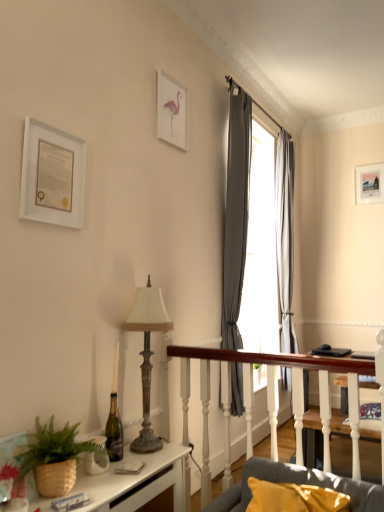
Question: Is white matte picture frame at upper left, the 1th picture frame positioned from the front, surrounding brown woven basket at lower left?

Choices:
 (A) yes
 (B) no

Answer: (B)

Question: From a real-world perspective, is white matte picture frame at upper left, which is counted as the 3th picture frame, starting from the right, on top of brown woven basket at lower left?

Choices:
 (A) no
 (B) yes

Answer: (B)

Question: Does white matte picture frame at upper left, the 1th picture frame positioned from the front, have a smaller size compared to brown woven basket at lower left?

Choices:
 (A) no
 (B) yes

Answer: (B)

Question: Can we say white matte picture frame at upper left, which is the third picture frame from back to front, lies outside brown woven basket at lower left?

Choices:
 (A) no
 (B) yes

Answer: (B)

Question: Is white matte picture frame at upper left, arranged as the first picture frame when viewed from the left, beside brown woven basket at lower left?

Choices:
 (A) no
 (B) yes

Answer: (A)

Question: From the image's perspective, is white matte picture frame at upper left, the 1th picture frame positioned from the front, over brown woven basket at lower left?

Choices:
 (A) no
 (B) yes

Answer: (B)

Question: Does white glossy desk at lower left have a smaller size compared to white matte picture frame at upper center, acting as the 2th picture frame starting from the front?

Choices:
 (A) no
 (B) yes

Answer: (A)

Question: Can you confirm if white glossy desk at lower left is wider than white matte picture frame at upper center, marked as the second picture frame in a right-to-left arrangement?

Choices:
 (A) yes
 (B) no

Answer: (A)

Question: Could you tell me if white glossy desk at lower left is turned towards white matte picture frame at upper center, positioned as the 2th picture frame in back-to-front order?

Choices:
 (A) no
 (B) yes

Answer: (A)

Question: From the image's perspective, is white glossy desk at lower left located beneath white matte picture frame at upper center, positioned as the 2th picture frame in back-to-front order?

Choices:
 (A) yes
 (B) no

Answer: (A)

Question: From a real-world perspective, does white glossy desk at lower left sit lower than white matte picture frame at upper center, positioned as the 2th picture frame in back-to-front order?

Choices:
 (A) yes
 (B) no

Answer: (A)

Question: From a real-world perspective, is white glossy desk at lower left positioned over white matte picture frame at upper center, positioned as the 2th picture frame in back-to-front order, based on gravity?

Choices:
 (A) yes
 (B) no

Answer: (B)

Question: Is gray fabric curtain at upper right, the 2th curtain in the right-to-left sequence, at the left side of gray fabric curtain at upper right, the 1th curtain viewed from the right?

Choices:
 (A) no
 (B) yes

Answer: (B)